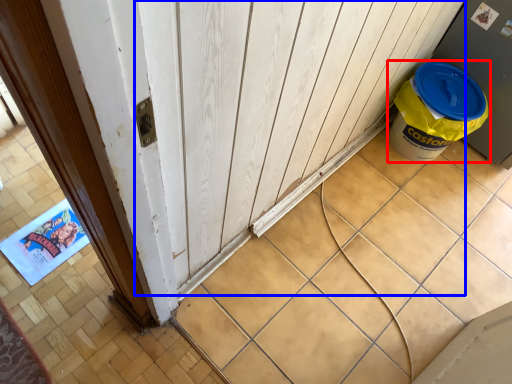
Question: Which of the following is the closest to the observer, waste container (highlighted by a red box) or barn door (highlighted by a blue box)?

Choices:
 (A) waste container
 (B) barn door

Answer: (B)